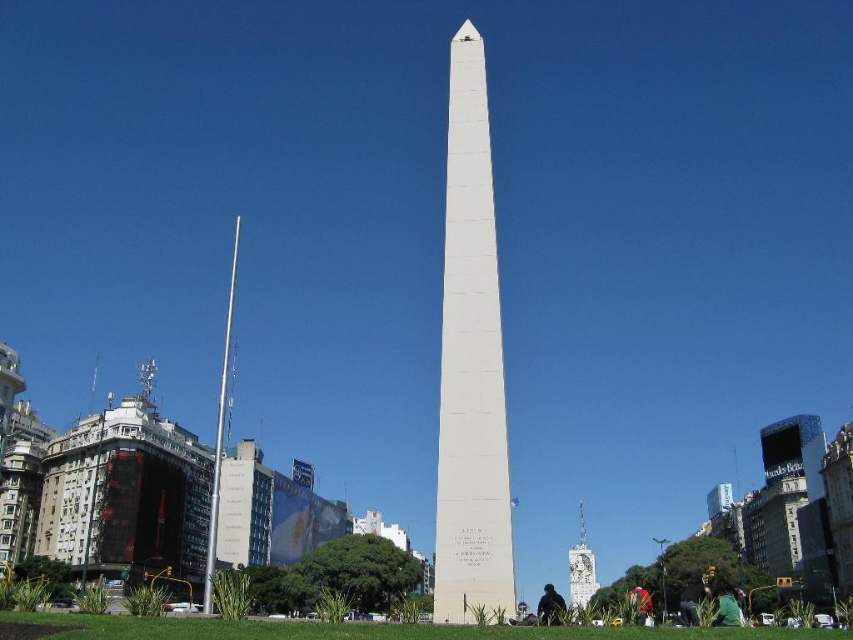
You are standing in front of the white polished stone obelisk at center and want to place the red fabric bag at lower right next to it. Considering their shapes, which object is narrower?

The white polished stone obelisk at center is thinner than the red fabric bag at lower right, so the obelisk is narrower.

You are standing at the base of the white obelisk monument and want to walk to the point marked as point (729, 625). However, there is an obstacle at point (456, 449). Will you be able to see the obstacle from your current position?

Yes, because point (456, 449) is in front of point (729, 625), so it will be visible from the base of the obelisk monument.

You are standing in front of the white marble obelisk at center and want to place the red fabric bag at lower right next to it. Which object is wider so that the bag can be placed beside it without overlapping?

The white marble obelisk at center is wider than the red fabric bag at lower right, so placing the bag next to it should be possible without overlapping.